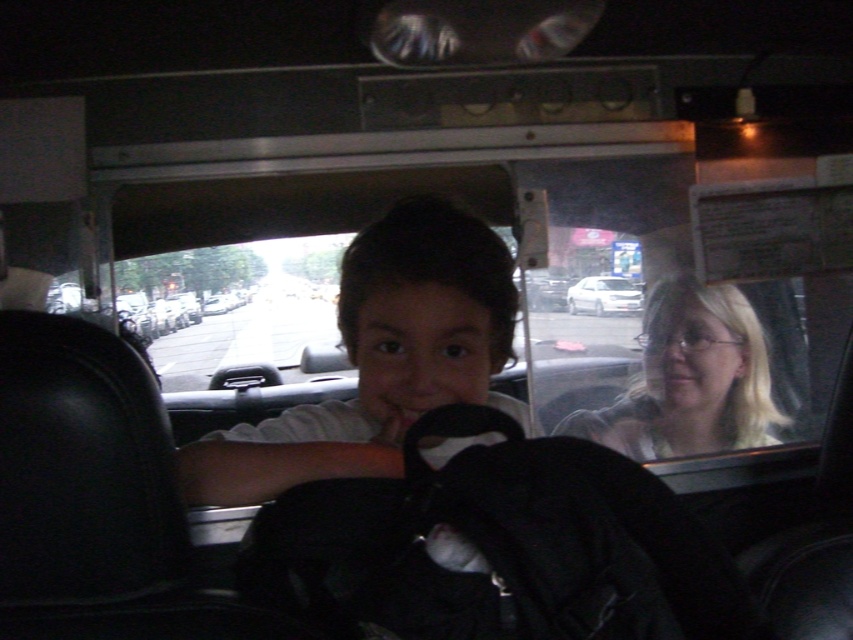
Locate an element on the screen. smooth skin child at center is located at coordinates (380, 358).

Does smooth skin child at center have a lesser width compared to blonde hair at center?

Incorrect, smooth skin child at center's width is not less than blonde hair at center's.

I want to click on smooth skin child at center, so click(380, 358).

Identify the location of smooth skin child at center. The width and height of the screenshot is (853, 640). (380, 358).

Does smooth skin child at center appear over white glossy sedan at center?

Actually, smooth skin child at center is below white glossy sedan at center.

Can you confirm if smooth skin child at center is taller than white glossy sedan at center?

Yes, smooth skin child at center is taller than white glossy sedan at center.

Which is in front, point (239, 484) or point (625, 285)?

Positioned in front is point (239, 484).

Where is `smooth skin child at center`? The image size is (853, 640). smooth skin child at center is located at coordinates (380, 358).

The height and width of the screenshot is (640, 853). Find the location of `blonde hair at center`. blonde hair at center is located at coordinates (689, 380).

Does blonde hair at center come behind white glossy sedan at center?

No, it is in front of white glossy sedan at center.

Does point (698, 356) lie behind point (596, 291)?

No, (698, 356) is in front of (596, 291).

Locate an element on the screen. blonde hair at center is located at coordinates (689, 380).